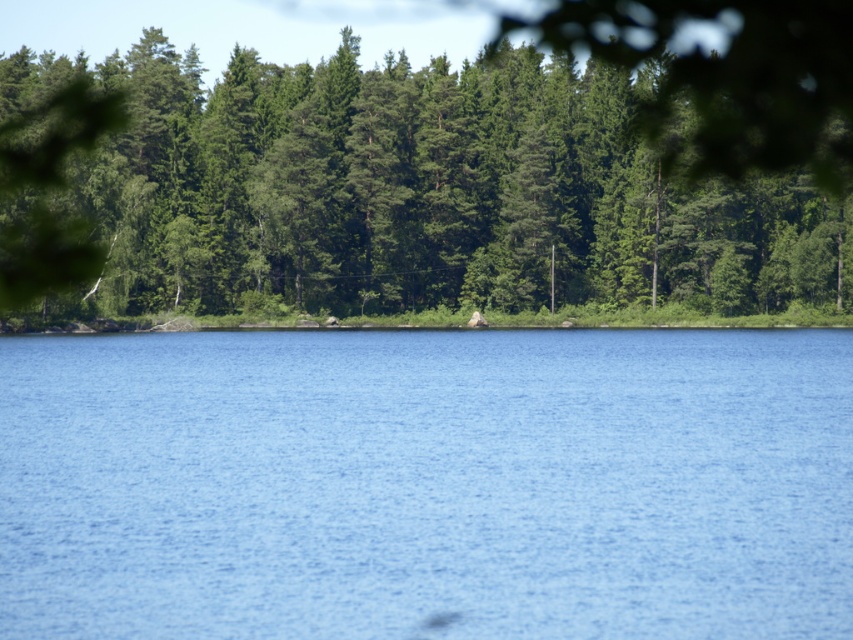
Question: Can you confirm if blue water at center is positioned to the right of green leafy trees at upper center?

Choices:
 (A) yes
 (B) no

Answer: (B)

Question: Is blue water at center to the right of green leafy trees at upper center from the viewer's perspective?

Choices:
 (A) no
 (B) yes

Answer: (A)

Question: Does blue water at center have a smaller size compared to green leafy trees at upper center?

Choices:
 (A) no
 (B) yes

Answer: (B)

Question: Which point appears closest to the camera in this image?

Choices:
 (A) (364, 557)
 (B) (700, 220)

Answer: (A)

Question: Which point appears closest to the camera in this image?

Choices:
 (A) (503, 620)
 (B) (453, 147)

Answer: (A)